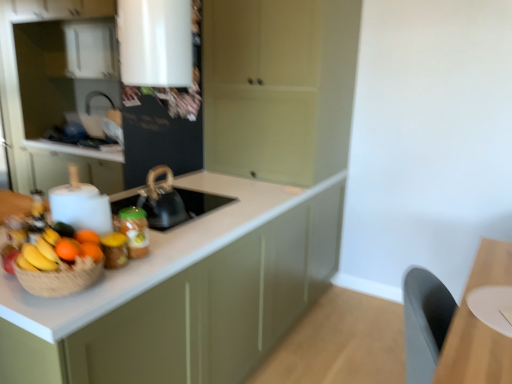
This screenshot has width=512, height=384. Find the location of `unoccupied space behind orange matte at left, arranged as the second orange when viewed from the back`. unoccupied space behind orange matte at left, arranged as the second orange when viewed from the back is located at coordinates (123, 261).